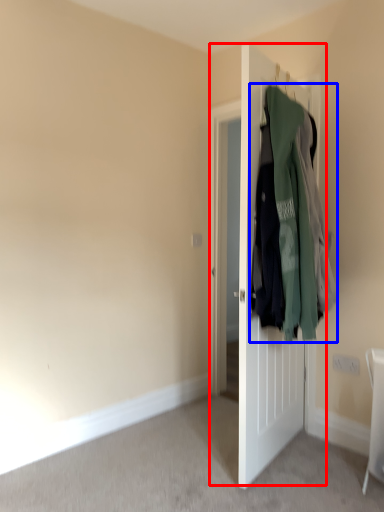
Question: Among these objects, which one is farthest to the camera, door (highlighted by a red box) or laundry (highlighted by a blue box)?

Choices:
 (A) door
 (B) laundry

Answer: (A)